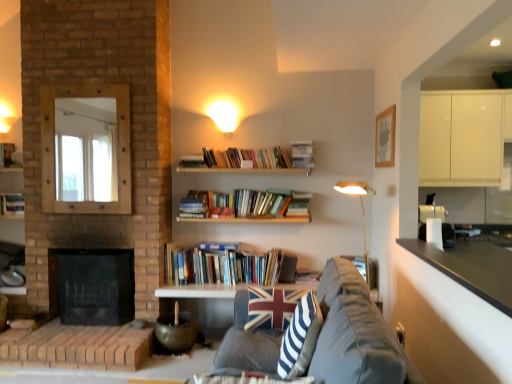
This screenshot has width=512, height=384. In order to click on free space above brown brick at lower left (from a real-world perspective) in this screenshot , I will do `click(81, 334)`.